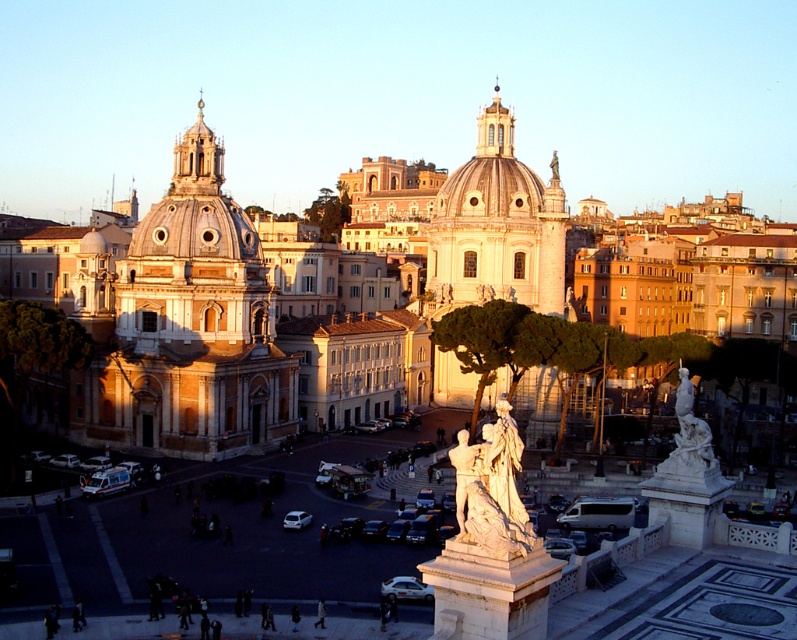
Is matte stone palace at center smaller than white metallic van at center?

No, matte stone palace at center is not smaller than white metallic van at center.

Is matte stone palace at center positioned before white metallic van at center?

No, it is not.

Between point (368, 413) and point (627, 516), which one is positioned in front?

Point (627, 516) is in front.

The height and width of the screenshot is (640, 797). I want to click on matte stone palace at center, so click(179, 323).

Who is taller, white marble statue at center or white metallic van at center?

Standing taller between the two is white marble statue at center.

Is point (481, 493) positioned before point (591, 500)?

Yes, point (481, 493) is in front of point (591, 500).

Is point (519, 516) farther from viewer compared to point (617, 502)?

No, it is not.

Identify the location of white marble statue at center. The width and height of the screenshot is (797, 640). (491, 488).

Describe the element at coordinates (491, 488) in the screenshot. I see `white marble statue at center` at that location.

Which is in front, point (505, 429) or point (678, 369)?

Point (505, 429) is more forward.

Locate an element on the screen. This screenshot has width=797, height=640. white marble statue at center is located at coordinates (491, 488).